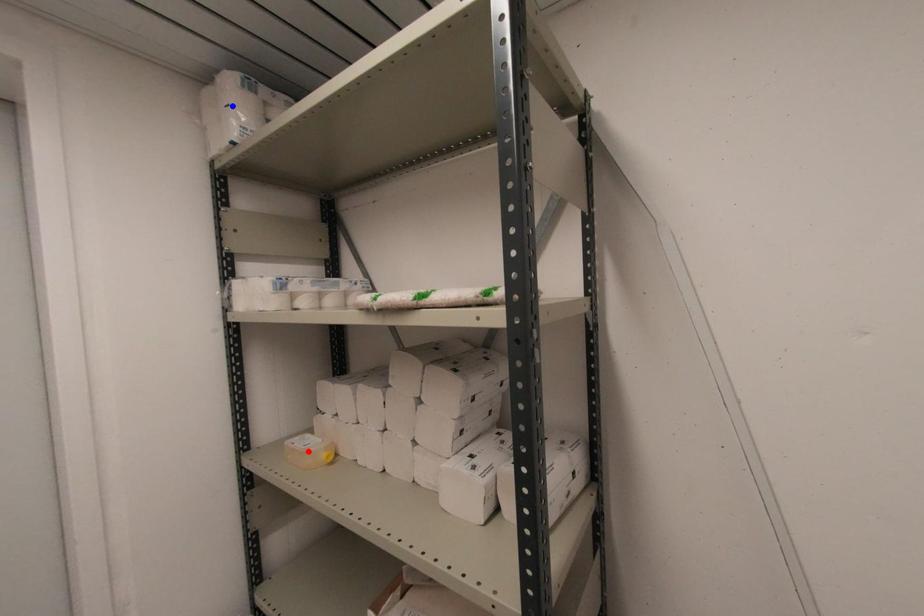
Question: In the image, two points are highlighted. Which point is nearer to the camera? Reply with the corresponding letter.

Choices:
 (A) blue point
 (B) red point

Answer: (A)